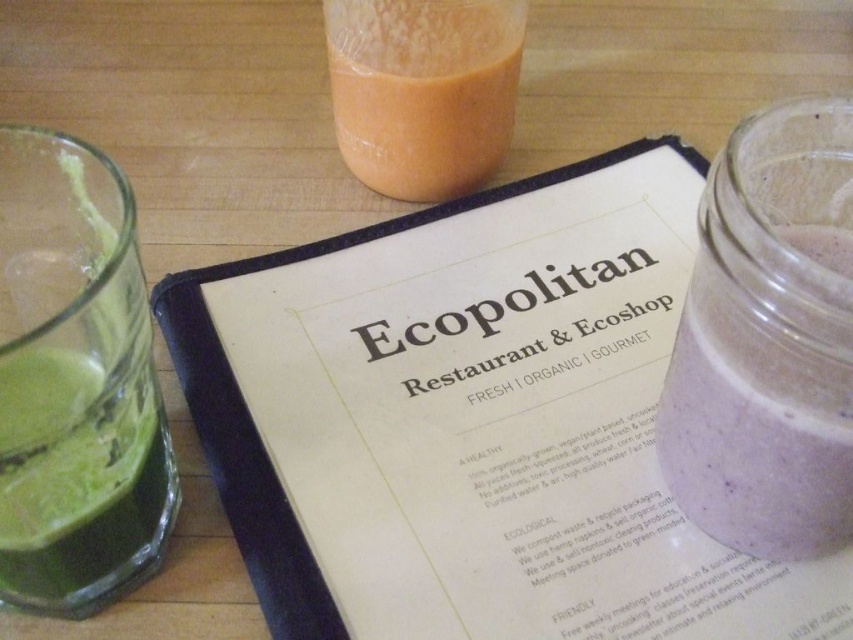
In the scene shown: You are a customer at the Ecopolitan Restaurant and you need to order from the menu. Where should you look on the table to find the white paper menu at center?

The white paper menu at center is located at the 2D coordinates point (480, 422) on the table.

You are a customer at the Ecopolitan Restaurant and you need to place your order. You see the white paper menu at center and the green glass at left. Which item is located to the right of the other?

The white paper menu at center is positioned on the right side of green glass at left, so the white paper menu at center is to the right of the green glass at left.